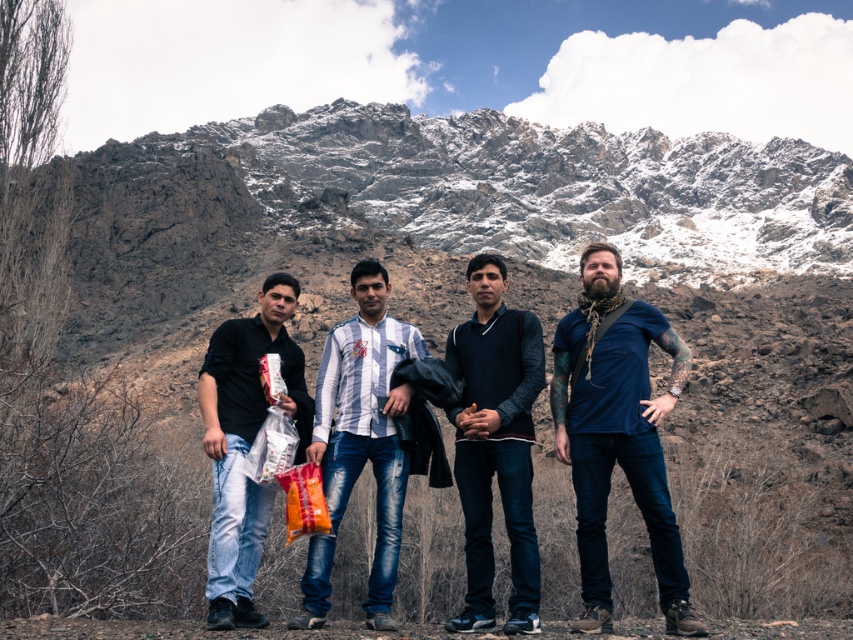
Question: Does white striped shirt at center have a larger size compared to matte black shirt at left?

Choices:
 (A) no
 (B) yes

Answer: (A)

Question: Estimate the real-world distances between objects in this image. Which object is farther from the matte black shirt at left?

Choices:
 (A) white striped shirt at center
 (B) dark blue sweater at center
 (C) blue denim jeans at right

Answer: (C)

Question: Does blue denim jeans at right appear under white striped shirt at center?

Choices:
 (A) no
 (B) yes

Answer: (B)

Question: Which is nearer to the dark blue sweater at center?

Choices:
 (A) white striped shirt at center
 (B) blue denim jeans at right
 (C) matte black shirt at left

Answer: (B)

Question: Estimate the real-world distances between objects in this image. Which object is closer to the blue denim jeans at right?

Choices:
 (A) white striped shirt at center
 (B) dark blue sweater at center
 (C) matte black shirt at left

Answer: (B)

Question: Does blue denim jeans at right appear on the right side of white striped shirt at center?

Choices:
 (A) yes
 (B) no

Answer: (A)